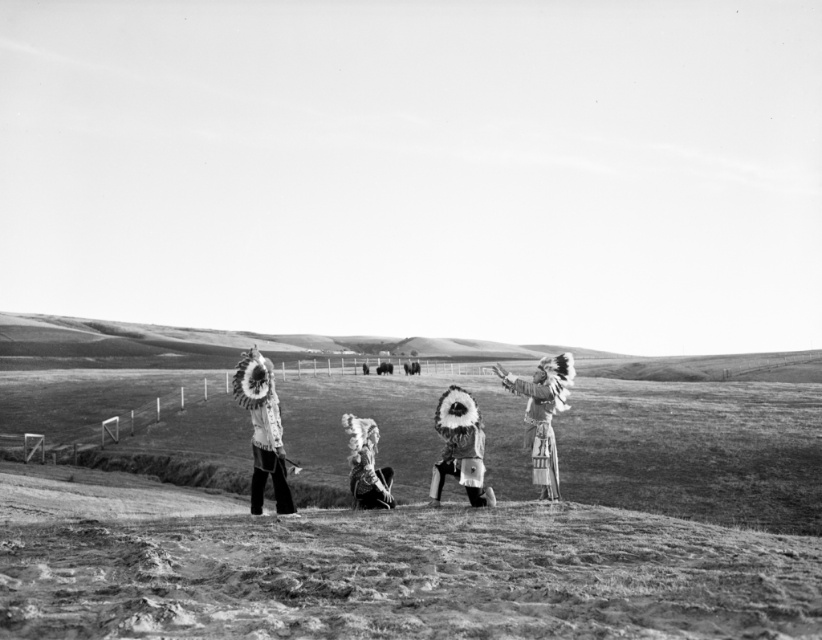
Based on the scene description, which headdress is taller between the feathered headdress at right and the fuzzy fur headdress at center?

The feathered headdress at right is taller than the fuzzy fur headdress at center.

Based on the scene described, where is the grassy hillside at center located in relation to the white feather headdress at center?

The grassy hillside at center is positioned on the left side of the white feather headdress at center.